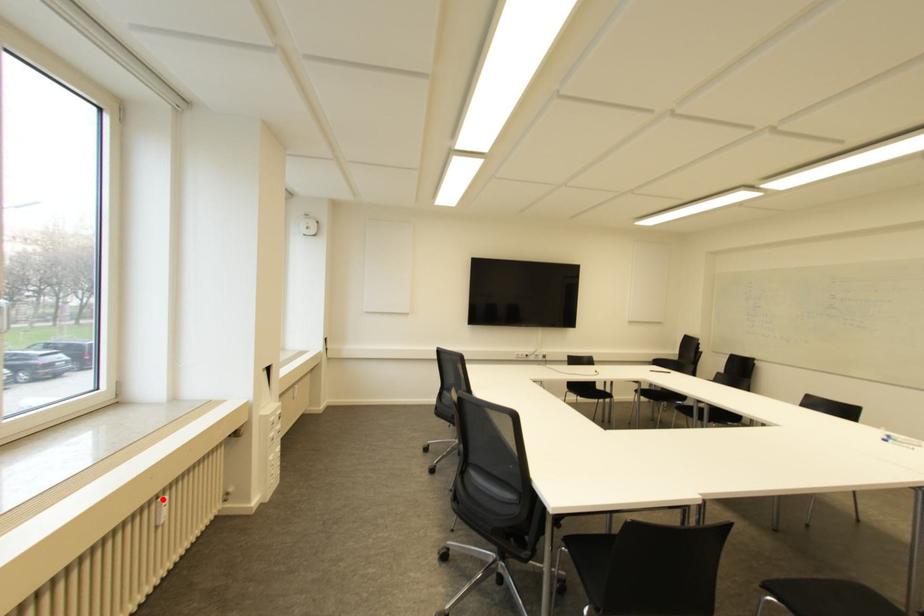
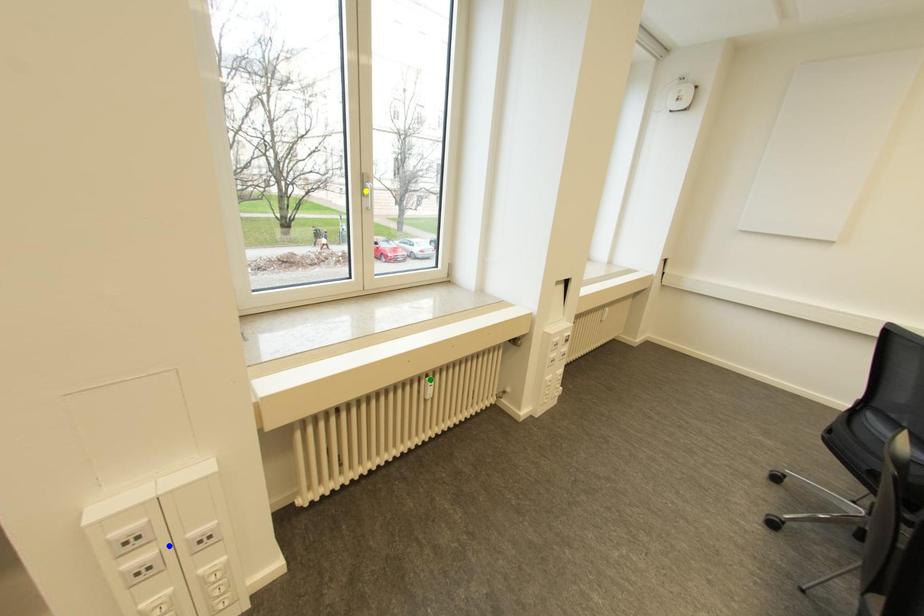
Question: I am providing you with two images of the same scene from different viewpoints. A red point is marked on the first image. You are given multiple points on the second image. Which mark in image 2 goes with the point in image 1?

Choices:
 (A) green point
 (B) yellow point
 (C) blue point

Answer: (A)